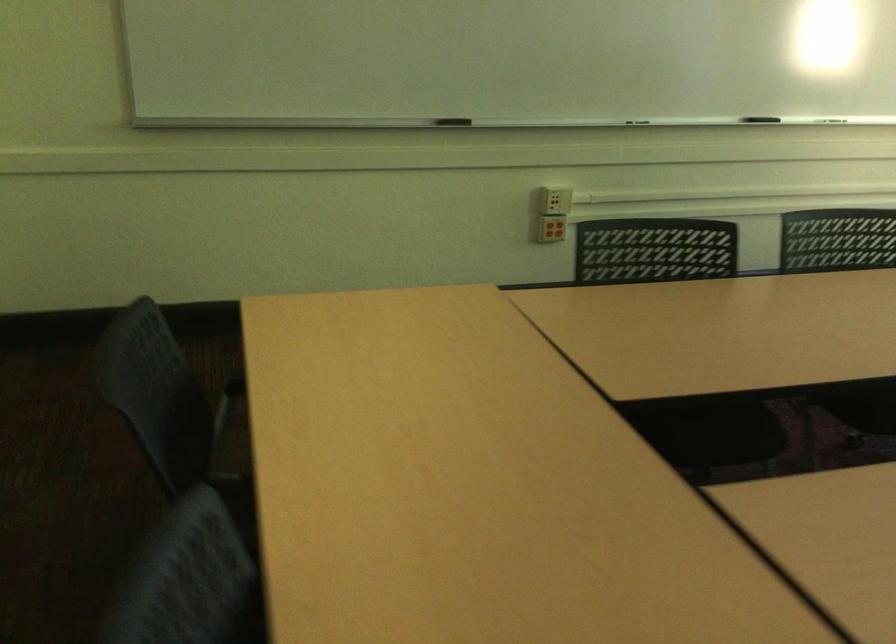
What are the coordinates of `black whiteboard marker` in the screenshot? It's located at (474, 118).